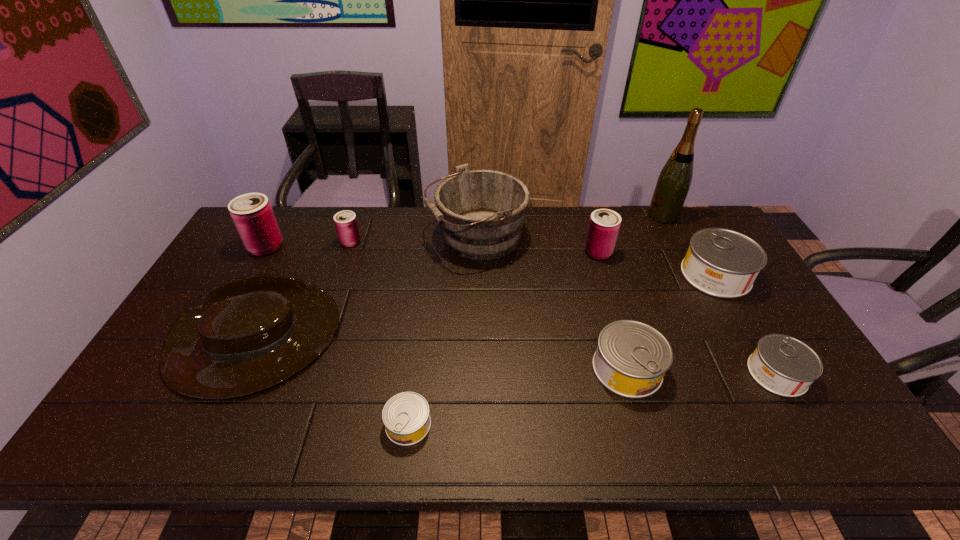
The image size is (960, 540). What are the coordinates of `green wine bottle` in the screenshot? It's located at (675, 178).

The image size is (960, 540). In order to click on wine bottle in this screenshot , I will do [675, 178].

At what (x,y) coordinates should I click in order to perform the action: click on wine bucket. Please return your answer as a coordinate pair (x, y). This screenshot has height=540, width=960. Looking at the image, I should click on (481, 212).

You are a GUI agent. You are given a task and a screenshot of the screen. Output one action in this format:
    pyautogui.click(x=<x>, y=<y>)
    Task: Click on the leftmost pink can
    This screenshot has height=540, width=960.
    Given the screenshot: What is the action you would take?
    pyautogui.click(x=252, y=214)

At what (x,y) coordinates should I click in order to perform the action: click on the leftmost can. Please return your answer as a coordinate pair (x, y). Looking at the image, I should click on (252, 214).

The image size is (960, 540). In order to click on the second tallest can in this screenshot , I will do `click(604, 224)`.

Where is `the second smallest pink can`? the second smallest pink can is located at coordinates (604, 224).

Identify the location of the biggest silver can. The width and height of the screenshot is (960, 540). (722, 263).

The image size is (960, 540). In order to click on the sixth can from right to left in this screenshot , I will do `click(346, 224)`.

Where is `the second pink can from left to right`? This screenshot has height=540, width=960. the second pink can from left to right is located at coordinates (346, 224).